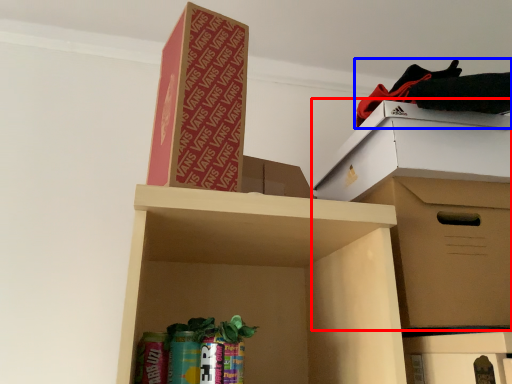
Question: Among these objects, which one is nearest to the camera, cardboard box (highlighted by a red box) or clothing (highlighted by a blue box)?

Choices:
 (A) cardboard box
 (B) clothing

Answer: (A)